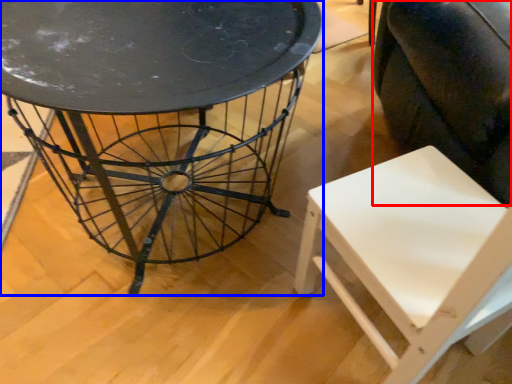
Question: Which point is further to the camera, swivel chair (highlighted by a red box) or table (highlighted by a blue box)?

Choices:
 (A) swivel chair
 (B) table

Answer: (B)